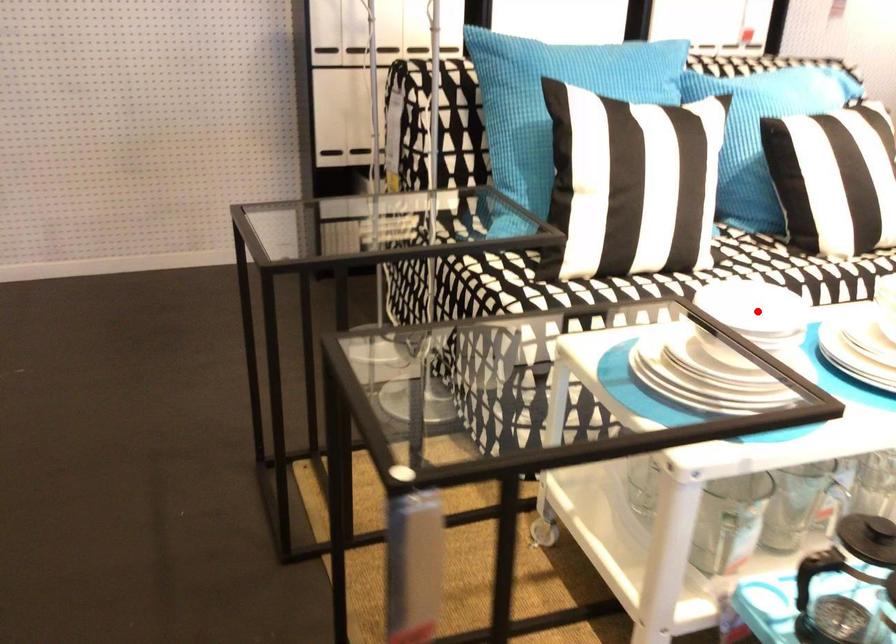
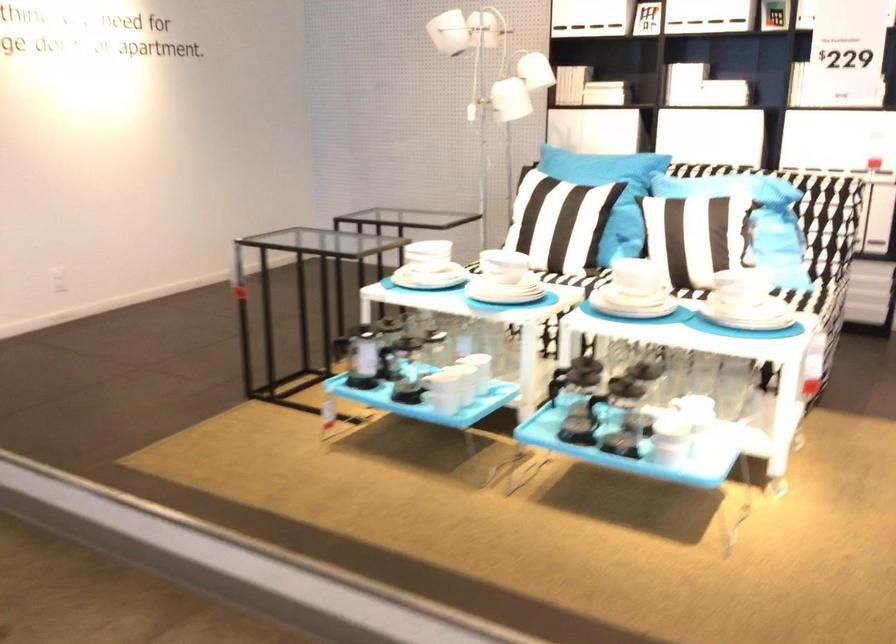
Question: I am providing you with two images of the same scene from different viewpoints. A red point is marked on the first image. Is the red point's position out of view in image 2?

Choices:
 (A) Yes
 (B) No

Answer: (A)